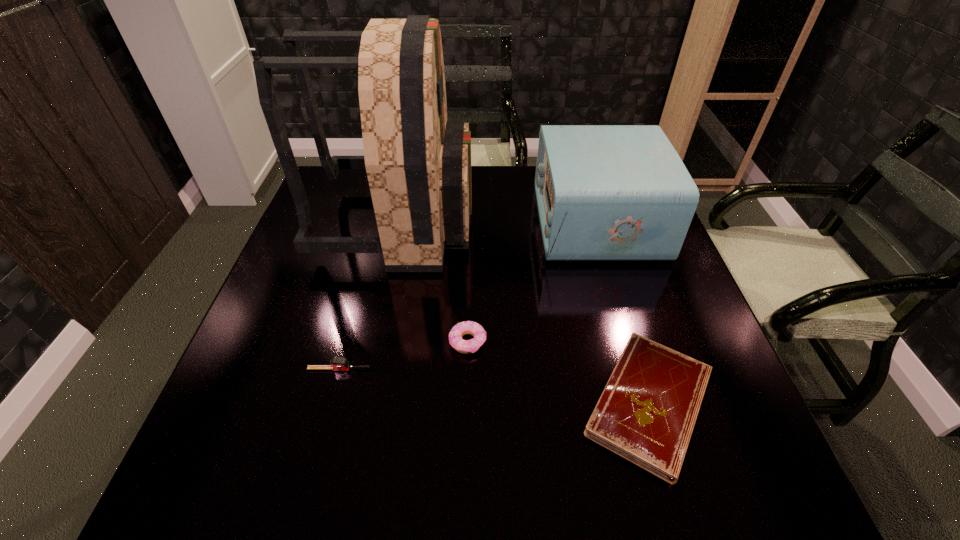
Find the location of a particular element. This screenshot has width=960, height=540. backpack is located at coordinates (418, 164).

You are a GUI agent. You are given a task and a screenshot of the screen. Output one action in this format:
    pyautogui.click(x=<x>, y=<y>)
    Task: Click on the fourth shortest object
    
    Given the screenshot: What is the action you would take?
    pyautogui.click(x=604, y=192)

The image size is (960, 540). I want to click on tape measure, so click(x=336, y=363).

This screenshot has width=960, height=540. What are the coordinates of `doughnut` in the screenshot? It's located at (476, 330).

Find the location of a particular element. Image resolution: width=960 pixels, height=540 pixels. the shortest object is located at coordinates pyautogui.click(x=647, y=412).

Locate an element on the screen. The height and width of the screenshot is (540, 960). free space located 0.090m on the front face of the backpack is located at coordinates (504, 221).

Find the location of a particular element. The width and height of the screenshot is (960, 540). free region located on the front panel of the second tallest object is located at coordinates (502, 221).

The image size is (960, 540). Find the location of `vacant space located 0.050m on the front panel of the second tallest object`. vacant space located 0.050m on the front panel of the second tallest object is located at coordinates (520, 221).

At what (x,y) coordinates should I click in order to perform the action: click on free space located 0.350m on the front panel of the second tallest object. Please return your answer as a coordinate pair (x, y). The height and width of the screenshot is (540, 960). Looking at the image, I should click on (413, 221).

I want to click on vacant region located 0.150m on the back of the tape measure, so click(x=355, y=309).